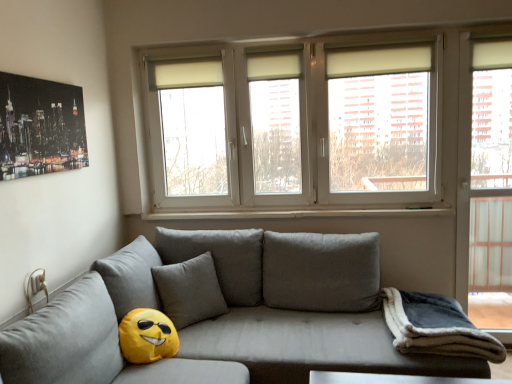
This screenshot has width=512, height=384. What are the coordinates of `free spot above shiny metallic poster at upper left (from a real-world perspective)` in the screenshot? It's located at (29, 77).